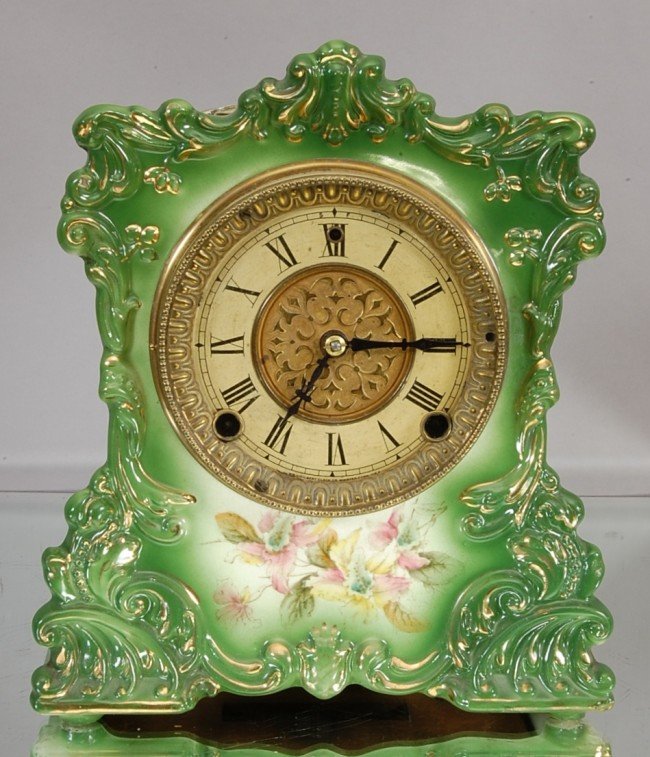
Where is `ceramic clock`? This screenshot has height=757, width=650. ceramic clock is located at coordinates (457, 182).